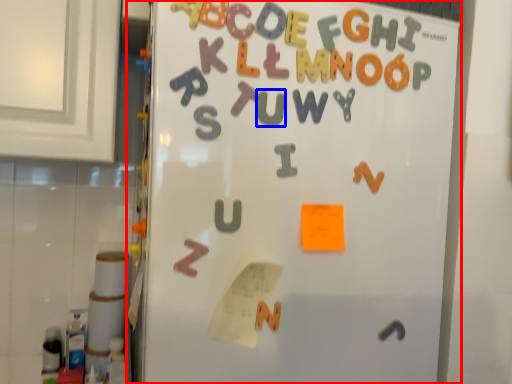
Question: Which of the following is the farthest to the observer, refrigerator (highlighted by a red box) or letter (highlighted by a blue box)?

Choices:
 (A) refrigerator
 (B) letter

Answer: (B)